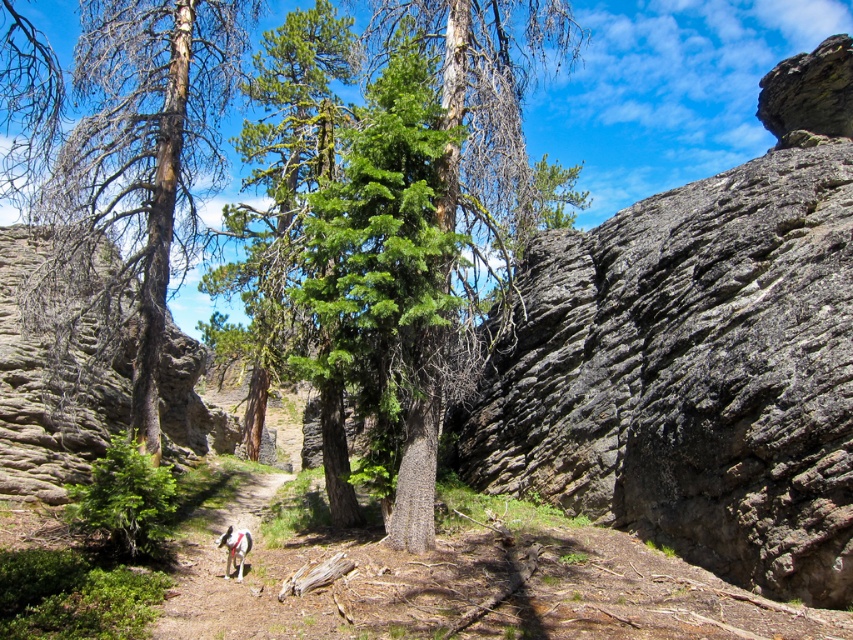
Which is behind, point (202, 132) or point (293, 476)?

Positioned behind is point (293, 476).

Is green textured tree at center positioned behind white fur dog at center?

Yes, green textured tree at center is behind white fur dog at center.

Is point (132, 392) farther from viewer compared to point (195, 604)?

That is True.

Where is `green textured tree at center`? green textured tree at center is located at coordinates (144, 148).

Who is higher up, green textured tree at center or white fur dog at lower center?

Positioned higher is green textured tree at center.

Describe the element at coordinates (144, 148) in the screenshot. I see `green textured tree at center` at that location.

This screenshot has height=640, width=853. Describe the element at coordinates (144, 148) in the screenshot. I see `green textured tree at center` at that location.

Identify the location of green textured tree at center. The image size is (853, 640). (144, 148).

Based on the photo, is white fur dog at center further to the viewer compared to white fur dog at lower center?

No, it is not.

Between white fur dog at center and white fur dog at lower center, which one is positioned lower?

white fur dog at center

Who is more distant from viewer, (x=206, y=572) or (x=219, y=545)?

The point (x=219, y=545) is more distant.

Locate an element on the screen. This screenshot has width=853, height=640. white fur dog at center is located at coordinates (213, 561).